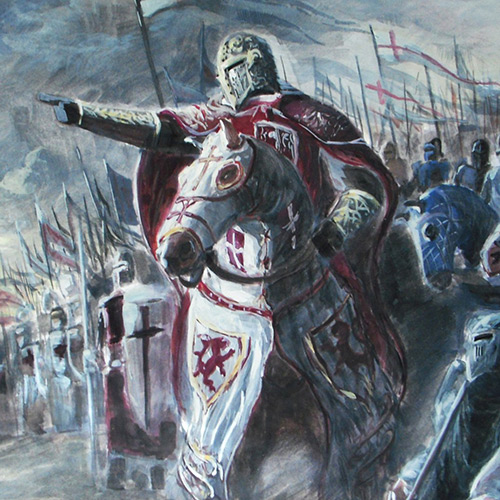
Identify the location of upper right corner of artwork. (496, 0).